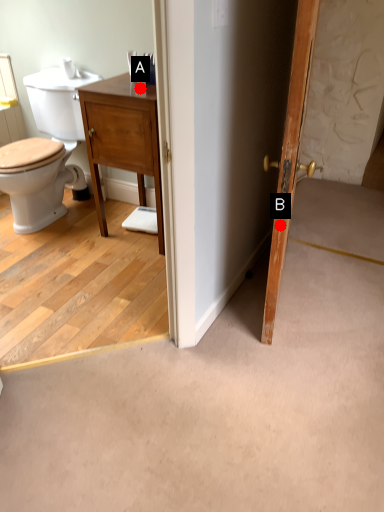
Question: Two points are circled on the image, labeled by A and B beside each circle. Among these points, which one is nearest to the camera?

Choices:
 (A) A is closer
 (B) B is closer

Answer: (B)